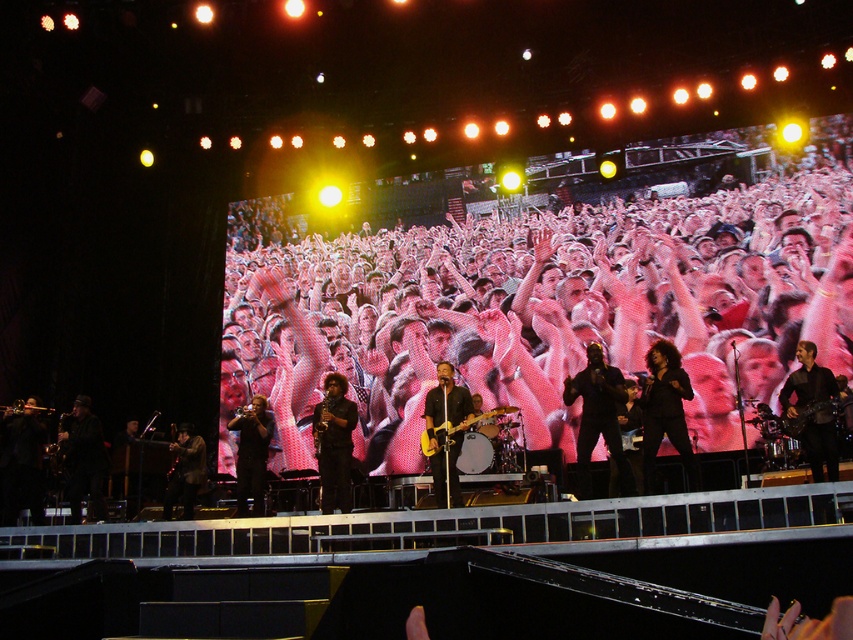
Question: Observing the image, what is the correct spatial positioning of shiny black guitar at center in reference to yellow electric guitar at center?

Choices:
 (A) below
 (B) above

Answer: (A)

Question: Which of these objects is positioned farthest from the black leather jacket at center?

Choices:
 (A) brushed metal saxophone at center
 (B) shiny black guitar at center
 (C) shiny black guitar at lower left
 (D) black leather guitar at center

Answer: (D)

Question: Which of the following is the farthest from the observer?

Choices:
 (A) shiny black guitar at lower left
 (B) black leather guitar at center
 (C) black leather jacket at center
 (D) brushed metal saxophone at center

Answer: (A)

Question: Can you confirm if black leather jacket at center is thinner than yellow electric guitar at center?

Choices:
 (A) no
 (B) yes

Answer: (A)

Question: From the image, what is the correct spatial relationship of shiny black guitar at center in relation to yellow electric guitar at center?

Choices:
 (A) right
 (B) left

Answer: (B)

Question: Estimate the real-world distances between objects in this image. Which object is farther from the black leather jacket at center?

Choices:
 (A) shiny black guitar at center
 (B) shiny black guitar at lower left
 (C) black leather guitar at center

Answer: (C)